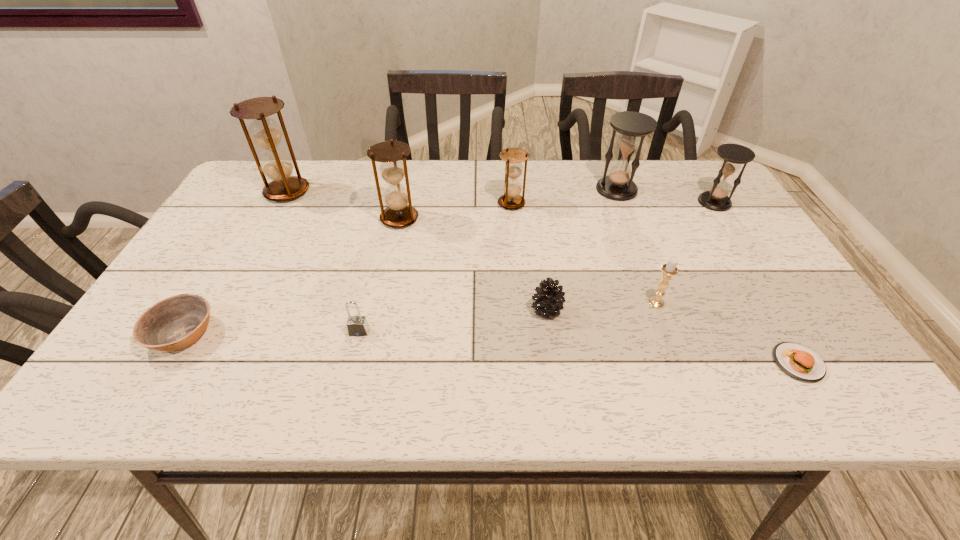
Find the location of `object at the far left corner`. object at the far left corner is located at coordinates (276, 165).

This screenshot has width=960, height=540. Identify the location of object at the far right corner. (716, 199).

I want to click on object that is at the near right corner, so click(x=798, y=361).

The image size is (960, 540). I want to click on free space at the far edge, so click(444, 161).

The image size is (960, 540). Identify the location of free space at the near edge of the desktop. (355, 403).

In the image, there is a desktop. Find the location of `vacant space at the left edge`. vacant space at the left edge is located at coordinates (198, 349).

The width and height of the screenshot is (960, 540). I want to click on vacant space at the right edge, so click(x=698, y=212).

Find the location of a particular element. vacant space at the far right corner of the desktop is located at coordinates (703, 170).

Identify the location of empty space that is in between the second shortest object and the food. Image resolution: width=960 pixels, height=540 pixels. (491, 348).

Where is `free spot between the candle holder and the left black hourglass`? The image size is (960, 540). free spot between the candle holder and the left black hourglass is located at coordinates (636, 246).